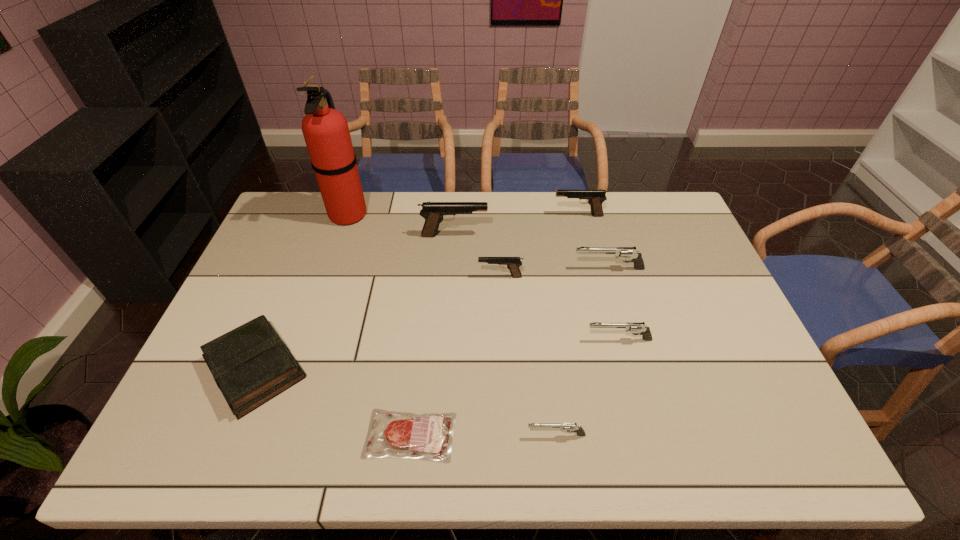
In the image, there is a desktop. At what (x,y) coordinates should I click in order to perform the action: click on vacant area at the near edge. Please return your answer as a coordinate pair (x, y). This screenshot has height=540, width=960. Looking at the image, I should click on (663, 449).

The image size is (960, 540). In order to click on vacant area at the left edge in this screenshot , I will do `click(287, 280)`.

I want to click on vacant space at the right edge of the desktop, so (701, 328).

In the image, there is a desktop. Where is `vacant space at the far left corner`? vacant space at the far left corner is located at coordinates (318, 219).

Image resolution: width=960 pixels, height=540 pixels. Find the location of `blank space at the far right corner of the desktop`. blank space at the far right corner of the desktop is located at coordinates (677, 209).

This screenshot has width=960, height=540. I want to click on vacant point located between the second nearest black pistol and the sixth nearest object, so [x=532, y=252].

Find the location of a particular element. unoccupied area between the steak and the sixth nearest object is located at coordinates (510, 352).

The width and height of the screenshot is (960, 540). Identify the location of free area in between the fourth farthest object and the nearest black pistol. (554, 273).

Find the location of a particular element. The image size is (960, 540). free space between the shortest object and the second tallest object is located at coordinates pyautogui.click(x=432, y=335).

Locate an element on the screen. free area in between the fire extinguisher and the sixth nearest object is located at coordinates (478, 241).